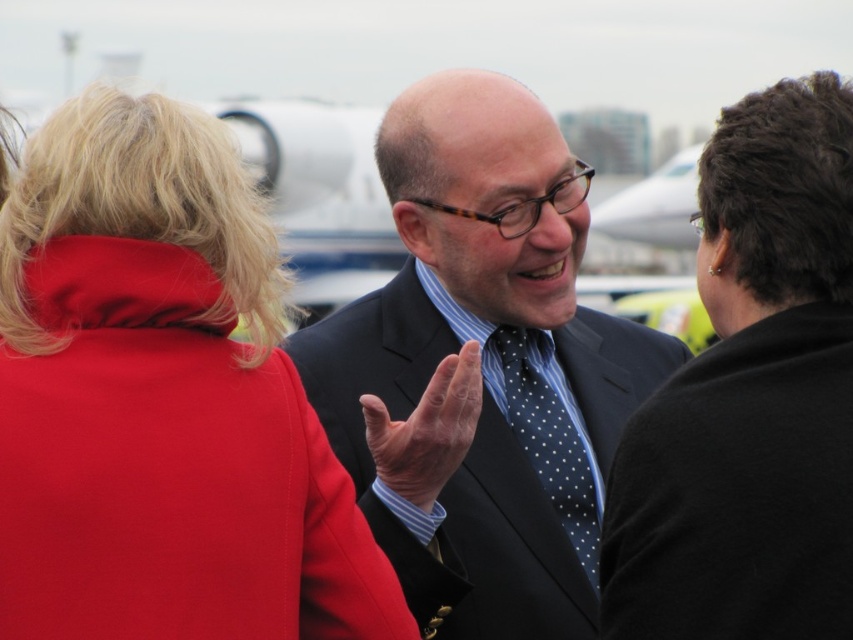
Does matte black suit at center appear over black woolen jacket at upper right?

Incorrect, matte black suit at center is not positioned above black woolen jacket at upper right.

Where is `matte black suit at center`? matte black suit at center is located at coordinates (482, 369).

Is point (563, 422) farther from camera compared to point (412, 486)?

Yes.

Which is in front, point (579, 442) or point (444, 448)?

Point (444, 448) is in front.

The image size is (853, 640). Find the location of `blue dotted fabric tie at center`. blue dotted fabric tie at center is located at coordinates (549, 442).

Is matte red coat at left further to the viewer compared to black woolen jacket at upper right?

No, matte red coat at left is in front of black woolen jacket at upper right.

Is point (97, 189) more distant than point (817, 186)?

No, (97, 189) is in front of (817, 186).

Which is behind, point (62, 592) or point (793, 448)?

Point (793, 448)

This screenshot has height=640, width=853. Identify the location of matte red coat at left. (161, 403).